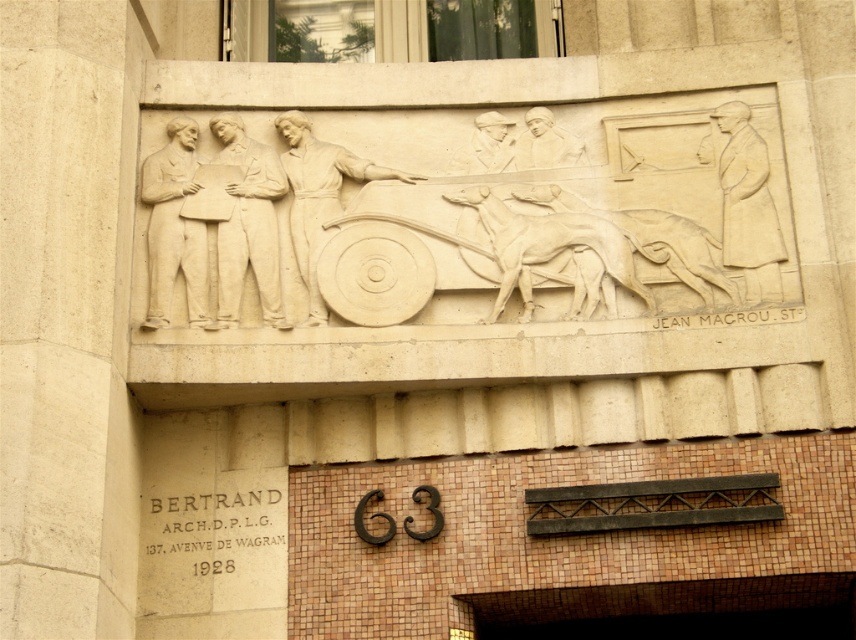
Who is shorter, brown mosaic tile at lower center or matte stone man at center?

matte stone man at center is shorter.

Is point (704, 621) less distant than point (512, 157)?

Yes, point (704, 621) is in front of point (512, 157).

Image resolution: width=856 pixels, height=640 pixels. What do you see at coordinates (673, 609) in the screenshot?
I see `brown mosaic tile at lower center` at bounding box center [673, 609].

Image resolution: width=856 pixels, height=640 pixels. Find the location of `brown mosaic tile at lower center`. brown mosaic tile at lower center is located at coordinates (673, 609).

Is white stone horses at center positioned before matte beige figure at upper right?

No, white stone horses at center is further to the viewer.

Is point (459, 196) more distant than point (770, 244)?

Yes.

Does point (565, 244) come closer to viewer compared to point (703, 152)?

Yes, point (565, 244) is in front of point (703, 152).

You are a GUI agent. You are given a task and a screenshot of the screen. Output one action in this format:
    pyautogui.click(x=<x>, y=<y>)
    Task: Click on the white stone horses at center
    
    Given the screenshot: What is the action you would take?
    pyautogui.click(x=551, y=246)

In the scene shown: Between white stone figures at left and white stone horses at center, which one is positioned lower?

white stone figures at left

Between point (284, 188) and point (522, 298), which one is positioned in front?

Point (522, 298) is in front.

Which is behind, point (241, 120) or point (506, 275)?

The point (241, 120) is more distant.

You are a GUI agent. You are given a task and a screenshot of the screen. Output one action in this format:
    pyautogui.click(x=<x>, y=<y>)
    Task: Click on the white stone figures at left
    
    Given the screenshot: What is the action you would take?
    pyautogui.click(x=248, y=225)